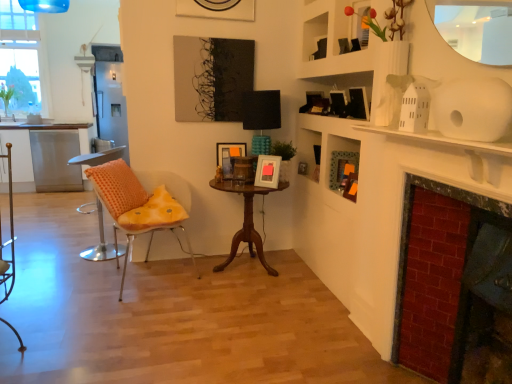
Question: Can you confirm if red brick fireplace at right is thinner than metallic silver armchair at left?

Choices:
 (A) yes
 (B) no

Answer: (A)

Question: From a real-world perspective, is red brick fireplace at right beneath metallic silver armchair at left?

Choices:
 (A) yes
 (B) no

Answer: (B)

Question: Is red brick fireplace at right facing away from metallic silver armchair at left?

Choices:
 (A) no
 (B) yes

Answer: (A)

Question: Considering the relative sizes of red brick fireplace at right and metallic silver armchair at left in the image provided, is red brick fireplace at right shorter than metallic silver armchair at left?

Choices:
 (A) yes
 (B) no

Answer: (B)

Question: Is red brick fireplace at right far from metallic silver armchair at left?

Choices:
 (A) no
 (B) yes

Answer: (B)

Question: Relative to orange dotted fabric chair at left, the 1th chair in the left-to-right sequence, is red brick fireplace at right in front or behind?

Choices:
 (A) front
 (B) behind

Answer: (A)

Question: From the image's perspective, is red brick fireplace at right located above or below orange dotted fabric chair at left, the 1th chair in the left-to-right sequence?

Choices:
 (A) below
 (B) above

Answer: (A)

Question: Is point pos(395,299) positioned closer to the camera than point pos(99,155)?

Choices:
 (A) farther
 (B) closer

Answer: (B)

Question: Considering the positions of red brick fireplace at right and orange dotted fabric chair at left, arranged as the 2th chair when viewed from the right, in the image, is red brick fireplace at right wider or thinner than orange dotted fabric chair at left, arranged as the 2th chair when viewed from the right,?

Choices:
 (A) thin
 (B) wide

Answer: (A)

Question: Is metallic silver armchair at left in front of or behind mahogany wood table at center in the image?

Choices:
 (A) front
 (B) behind

Answer: (A)

Question: From a real-world perspective, is metallic silver armchair at left physically located above or below mahogany wood table at center?

Choices:
 (A) below
 (B) above

Answer: (B)

Question: Based on their sizes in the image, would you say metallic silver armchair at left is bigger or smaller than mahogany wood table at center?

Choices:
 (A) small
 (B) big

Answer: (A)

Question: From the image's perspective, relative to mahogany wood table at center, is metallic silver armchair at left above or below?

Choices:
 (A) above
 (B) below

Answer: (B)

Question: Do you think transparent glass window at upper left is within mahogany wood table at center, or outside of it?

Choices:
 (A) inside
 (B) outside

Answer: (B)

Question: Is transparent glass window at upper left to the left or to the right of mahogany wood table at center in the image?

Choices:
 (A) left
 (B) right

Answer: (A)